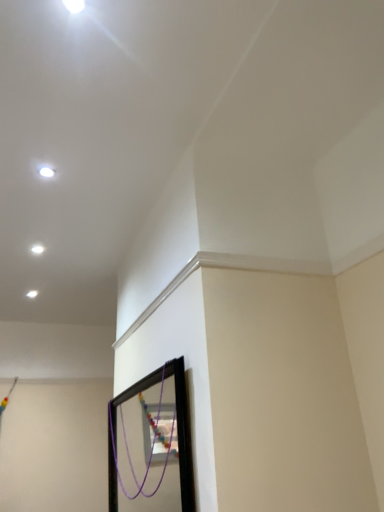
Question: Is point (39, 244) closer or farther from the camera than point (46, 167)?

Choices:
 (A) closer
 (B) farther

Answer: (B)

Question: Is white glossy light at upper left, which is counted as the first light, starting from the back, in front of or behind white glossy light at upper left, the 1th light viewed from the top, in the image?

Choices:
 (A) front
 (B) behind

Answer: (B)

Question: Considering the positions of white glossy light at upper left, arranged as the first light when viewed from the left, and white glossy light at upper left, the second light positioned from the left, in the image, is white glossy light at upper left, arranged as the first light when viewed from the left, wider or thinner than white glossy light at upper left, the second light positioned from the left,?

Choices:
 (A) wide
 (B) thin

Answer: (B)

Question: Based on their sizes in the image, would you say white glossy light at upper left, the 1th light viewed from the front, is bigger or smaller than white glossy light at upper left, the 1th light ordered from the bottom?

Choices:
 (A) big
 (B) small

Answer: (B)

Question: Is white glossy light at upper left, the second light positioned from the left, wider or thinner than white glossy light at upper left, the second light positioned from the right?

Choices:
 (A) wide
 (B) thin

Answer: (A)

Question: Is white glossy light at upper left, the second light in the back-to-front sequence, situated inside white glossy light at upper left, which is counted as the first light, starting from the back, or outside?

Choices:
 (A) inside
 (B) outside

Answer: (B)

Question: Visually, is white glossy light at upper left, the second light in the back-to-front sequence, positioned to the left or to the right of white glossy light at upper left, the second light in the top-to-bottom sequence?

Choices:
 (A) right
 (B) left

Answer: (A)